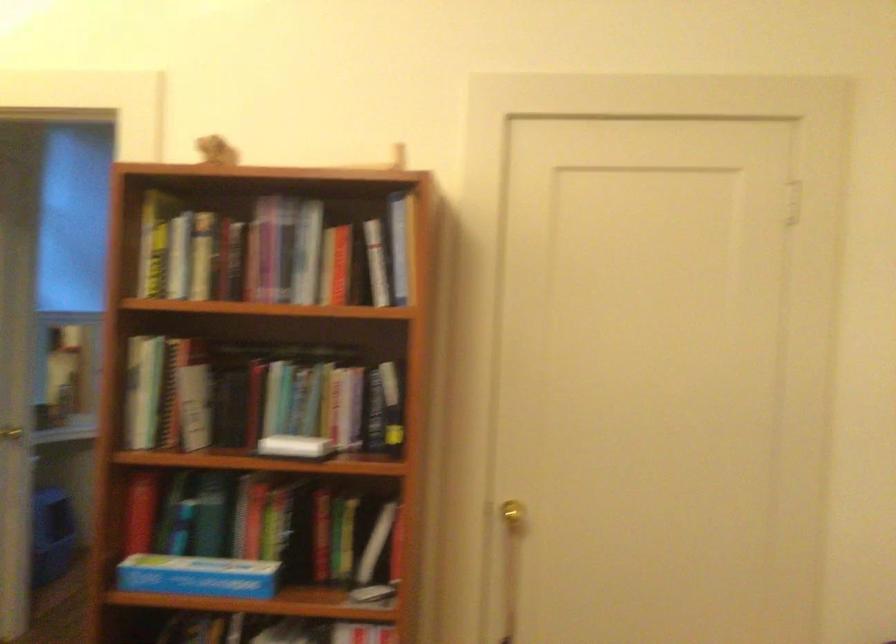
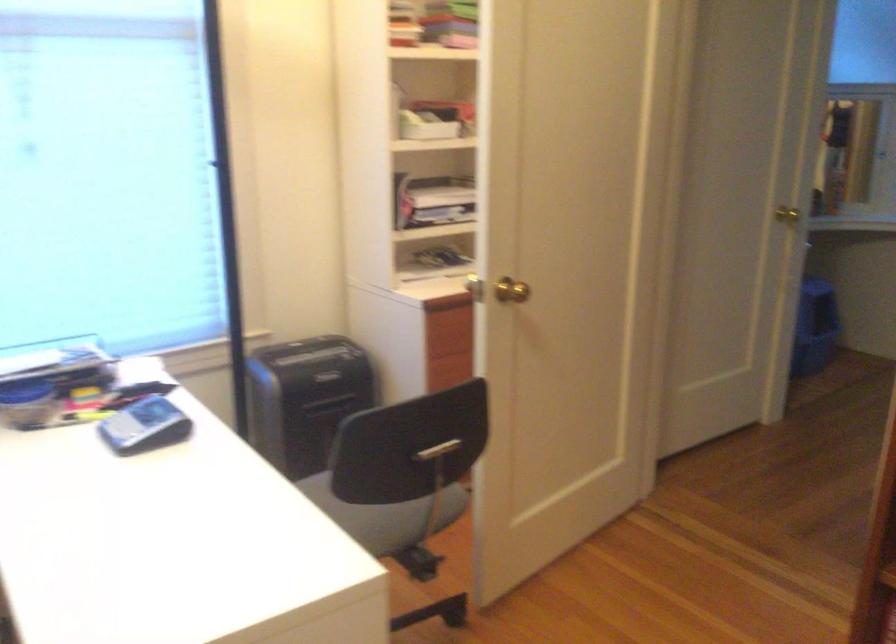
Question: The camera is either moving clockwise (left) or counter-clockwise (right) around the object. The first image is from the beginning of the video and the second image is from the end. Is the camera moving left or right when shooting the video?

Choices:
 (A) Left
 (B) Right

Answer: (B)